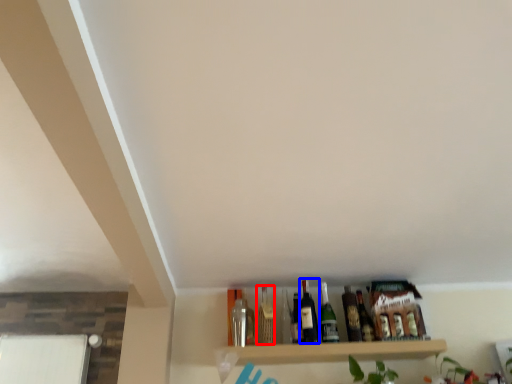
Question: Among these objects, which one is farthest to the camera, wine bottle (highlighted by a red box) or beer bottle (highlighted by a blue box)?

Choices:
 (A) wine bottle
 (B) beer bottle

Answer: (A)